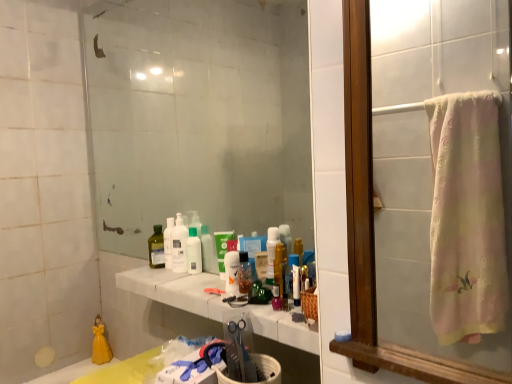
Question: From a real-world perspective, is yellow porcelain doll at lower left physically above transparent glass mirror at center, which is counted as the first mirror, starting from the left?

Choices:
 (A) yes
 (B) no

Answer: (B)

Question: Is yellow porcelain doll at lower left to the left of transparent glass mirror at center, the second mirror from the right, from the viewer's perspective?

Choices:
 (A) yes
 (B) no

Answer: (A)

Question: Does yellow porcelain doll at lower left have a greater width compared to transparent glass mirror at center, marked as the 1th mirror in a back-to-front arrangement?

Choices:
 (A) no
 (B) yes

Answer: (B)

Question: Are yellow porcelain doll at lower left and transparent glass mirror at center, which is counted as the first mirror, starting from the left, located far from each other?

Choices:
 (A) yes
 (B) no

Answer: (A)

Question: Considering the relative positions of yellow porcelain doll at lower left and transparent glass mirror at center, marked as the 1th mirror in a back-to-front arrangement, in the image provided, is yellow porcelain doll at lower left to the right of transparent glass mirror at center, marked as the 1th mirror in a back-to-front arrangement, from the viewer's perspective?

Choices:
 (A) no
 (B) yes

Answer: (A)

Question: From the image's perspective, is yellow porcelain doll at lower left on transparent glass mirror at center, which is counted as the first mirror, starting from the left?

Choices:
 (A) no
 (B) yes

Answer: (A)

Question: Is translucent plastic spray bottle at center, the first cleaning product when ordered from right to left, beside white glossy bottle at center, which is counted as the second cleaning product, starting from the front?

Choices:
 (A) no
 (B) yes

Answer: (A)

Question: From a real-world perspective, is translucent plastic spray bottle at center, the first cleaning product when ordered from right to left, located beneath white glossy bottle at center, which is counted as the second cleaning product, starting from the front?

Choices:
 (A) yes
 (B) no

Answer: (A)

Question: Can we say translucent plastic spray bottle at center, which appears as the second cleaning product when viewed from the left, lies outside white glossy bottle at center, placed as the 2th cleaning product when sorted from right to left?

Choices:
 (A) yes
 (B) no

Answer: (A)

Question: Does translucent plastic spray bottle at center, which appears as the second cleaning product when viewed from the left, contain white glossy bottle at center, which is counted as the second cleaning product, starting from the front?

Choices:
 (A) yes
 (B) no

Answer: (B)

Question: Is translucent plastic spray bottle at center, which appears as the second cleaning product when viewed from the left, wider than white glossy bottle at center, which is the 1th cleaning product in left-to-right order?

Choices:
 (A) yes
 (B) no

Answer: (B)

Question: From a real-world perspective, is translucent plastic spray bottle at center, the first cleaning product from the front, located higher than white glossy bottle at center, which is the 1th cleaning product in left-to-right order?

Choices:
 (A) no
 (B) yes

Answer: (A)

Question: From a real-world perspective, is pink fabric towel at right, which is the 1th mirror in right-to-left order, positioned under white marble counter at center based on gravity?

Choices:
 (A) no
 (B) yes

Answer: (A)